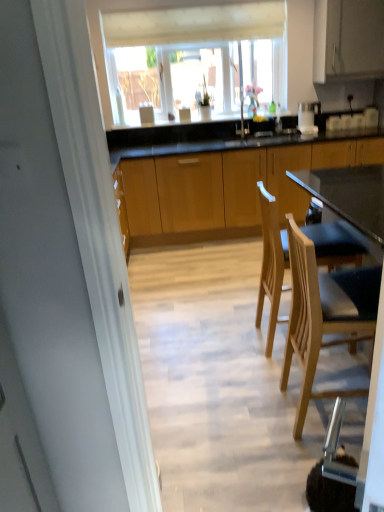
Question: Does transparent glass window at upper center turn towards light wood chair at lower right, positioned as the first chair in front-to-back order?

Choices:
 (A) yes
 (B) no

Answer: (A)

Question: Does transparent glass window at upper center lie in front of light wood chair at lower right, positioned as the first chair in front-to-back order?

Choices:
 (A) yes
 (B) no

Answer: (B)

Question: Is transparent glass window at upper center at the left side of light wood chair at lower right, which is the second chair from back to front?

Choices:
 (A) no
 (B) yes

Answer: (B)

Question: Would you say transparent glass window at upper center contains light wood chair at lower right, which is the second chair from back to front?

Choices:
 (A) no
 (B) yes

Answer: (A)

Question: Would you say transparent glass window at upper center is outside light wood chair at lower right, which is the second chair from back to front?

Choices:
 (A) no
 (B) yes

Answer: (B)

Question: Would you say transparent glass window at upper center is a long distance from light wood chair at lower right, which is the second chair from back to front?

Choices:
 (A) yes
 (B) no

Answer: (A)

Question: Is wooden cabinets at center, which is counted as the 2th cabinetry, starting from the top, far away from light wood chair at right, which appears as the first chair when viewed from the back?

Choices:
 (A) yes
 (B) no

Answer: (A)

Question: From the image's perspective, would you say wooden cabinets at center, which is counted as the 2th cabinetry, starting from the top, is shown under light wood chair at right, arranged as the second chair when viewed from the front?

Choices:
 (A) yes
 (B) no

Answer: (B)

Question: Considering the relative sizes of wooden cabinets at center, the 1th cabinetry ordered from the bottom, and light wood chair at right, which appears as the first chair when viewed from the back, in the image provided, is wooden cabinets at center, the 1th cabinetry ordered from the bottom, thinner than light wood chair at right, which appears as the first chair when viewed from the back,?

Choices:
 (A) no
 (B) yes

Answer: (A)

Question: Is the position of wooden cabinets at center, which is counted as the 2th cabinetry, starting from the top, less distant than that of light wood chair at right, which appears as the first chair when viewed from the back?

Choices:
 (A) no
 (B) yes

Answer: (A)

Question: Does wooden cabinets at center, which is counted as the 2th cabinetry, starting from the top, contain light wood chair at right, arranged as the second chair when viewed from the front?

Choices:
 (A) no
 (B) yes

Answer: (A)

Question: Does wooden cabinets at center, which is counted as the 2th cabinetry, starting from the top, turn towards light wood chair at right, arranged as the second chair when viewed from the front?

Choices:
 (A) yes
 (B) no

Answer: (A)

Question: Is transparent glass window at upper center taller than white matte cabinet at upper right, marked as the second cabinetry in a bottom-to-top arrangement?

Choices:
 (A) no
 (B) yes

Answer: (B)